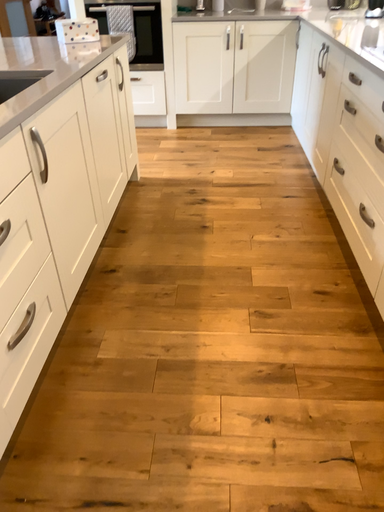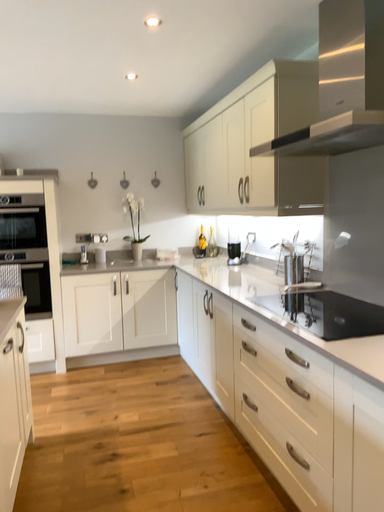
Question: Which way did the camera rotate in the video?

Choices:
 (A) rotated right
 (B) rotated left

Answer: (A)